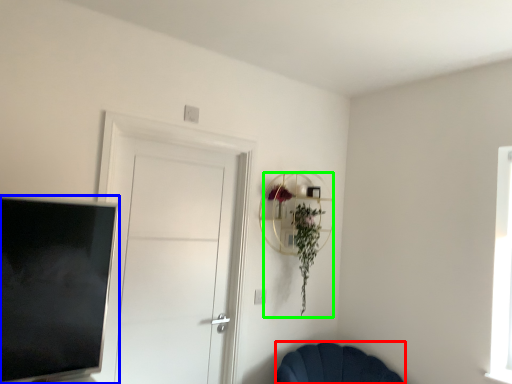
Question: Estimate the real-world distances between objects in this image. Which object is farther from chair (highlighted by a red box), television (highlighted by a blue box) or floral arrangement (highlighted by a green box)?

Choices:
 (A) television
 (B) floral arrangement

Answer: (A)